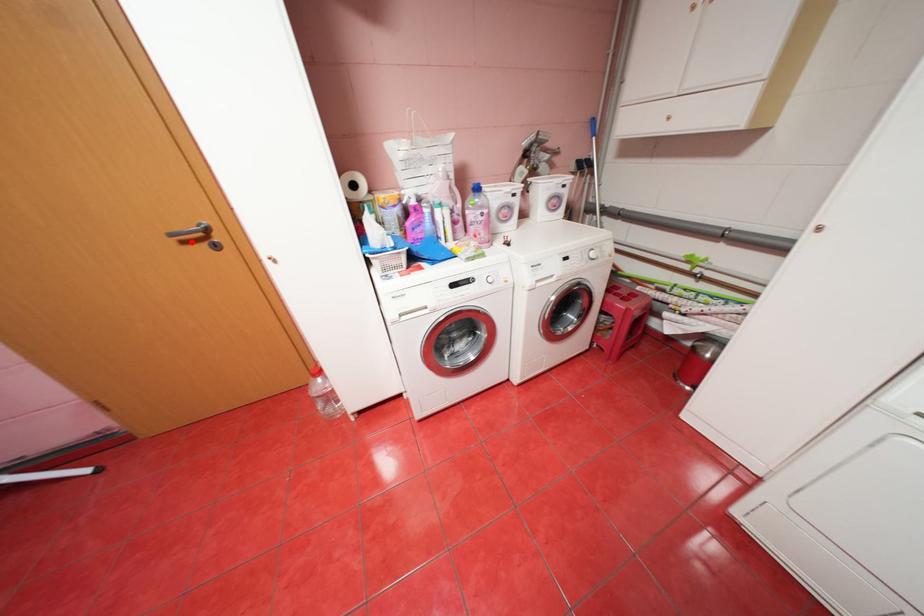
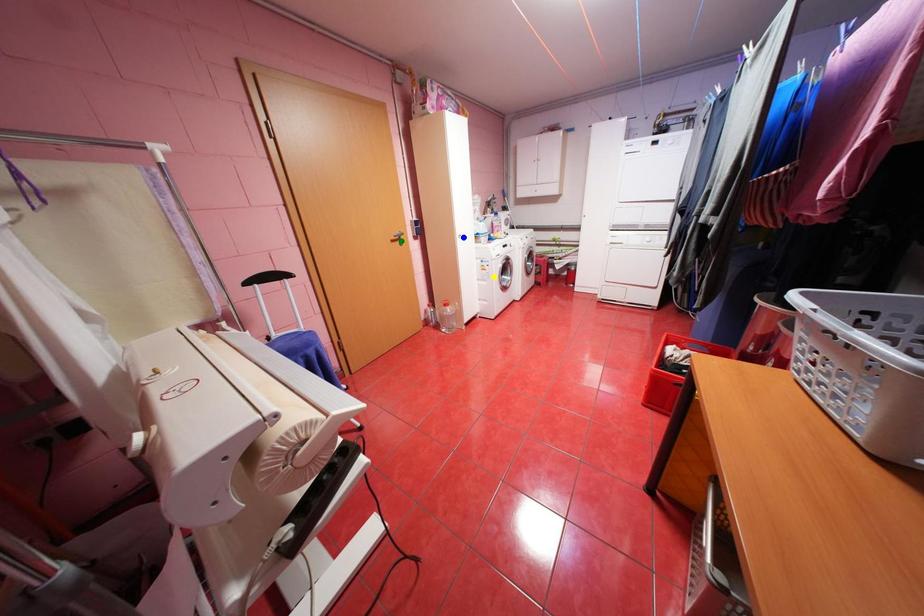
Question: I am providing you with two images of the same scene from different viewpoints. A red point is marked on the first image. You are given multiple points on the second image. Which point in image 2 is actually the same real-world point as the red point in image 1?

Choices:
 (A) green point
 (B) yellow point
 (C) blue point

Answer: (A)